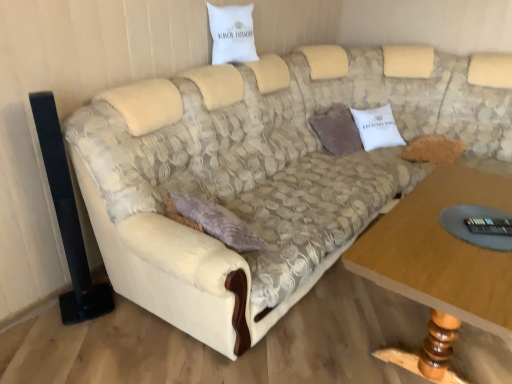
What are the coordinates of `vacant space situated above white fabric pillow at upper center, the second pillow when ordered from back to front (from a real-world perspective)` in the screenshot? It's located at (234, 1).